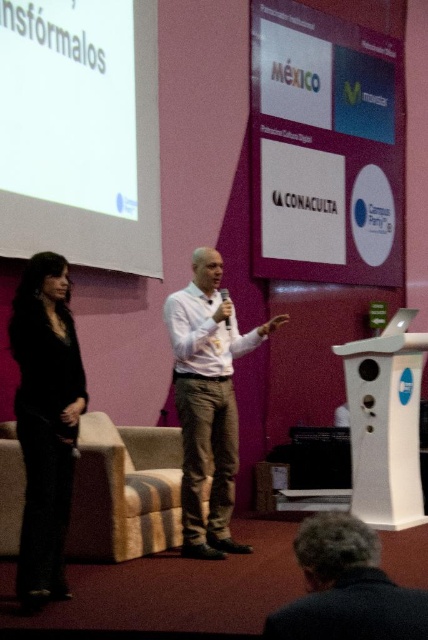
Question: Which object appears closest to the camera in this image?

Choices:
 (A) black matte pants at left
 (B) dark brown hair at lower center

Answer: (B)

Question: In this image, where is white matte projection screen at upper left located relative to white shirt at center?

Choices:
 (A) left
 (B) right

Answer: (A)

Question: Which point appears closest to the camera in this image?

Choices:
 (A) click(x=335, y=166)
 (B) click(x=155, y=90)
 (C) click(x=35, y=532)
 (D) click(x=225, y=308)

Answer: (C)

Question: Is white matte projection screen at upper left closer to camera compared to dark brown hair at lower center?

Choices:
 (A) no
 (B) yes

Answer: (A)

Question: Which point is closer to the camera taking this photo?

Choices:
 (A) (351, 582)
 (B) (332, 131)
 (C) (122, 124)

Answer: (A)

Question: Is black matte pants at left bigger than dark brown hair at lower center?

Choices:
 (A) yes
 (B) no

Answer: (A)